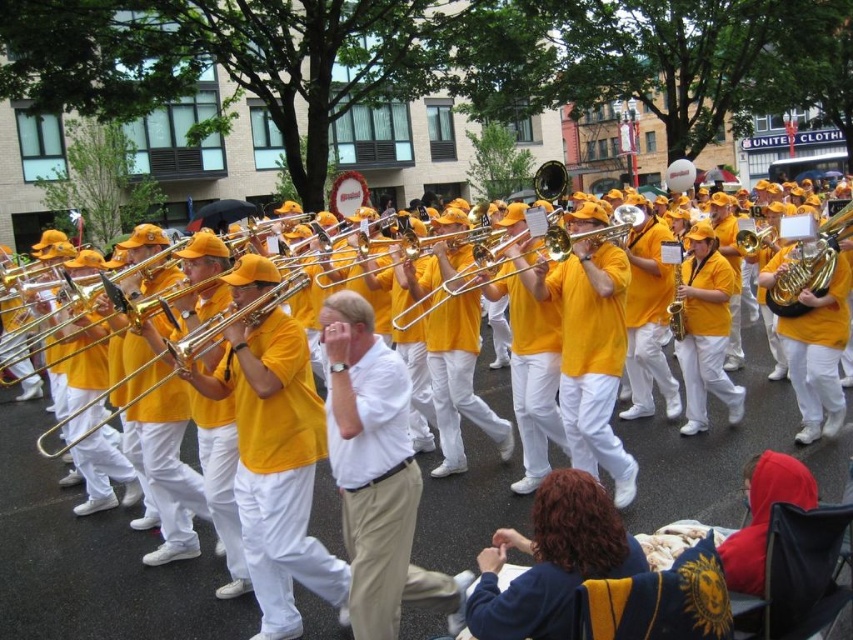
Is point (479, 500) more distant than point (762, 237)?

No.

Is matte yellow trombone at center taller than gold shiny trumpet at center?

Indeed, matte yellow trombone at center has a greater height compared to gold shiny trumpet at center.

You are a GUI agent. You are given a task and a screenshot of the screen. Output one action in this format:
    pyautogui.click(x=<x>, y=<y>)
    Task: Click on the matte yellow trombone at center
    This screenshot has width=853, height=640.
    Given the screenshot: What is the action you would take?
    pyautogui.click(x=91, y=561)

Is point (585, 481) farther from camera compared to point (772, 227)?

No, it is not.

Does dark blue fleece at lower center have a greater height compared to gold shiny trumpet at center?

Yes.

The height and width of the screenshot is (640, 853). I want to click on dark blue fleece at lower center, so click(x=550, y=561).

Does white cotton shirt at center appear on the left side of dark blue fleece at lower center?

Correct, you'll find white cotton shirt at center to the left of dark blue fleece at lower center.

Is point (387, 381) closer to viewer compared to point (492, 577)?

No.

Which is behind, point (404, 452) or point (561, 561)?

Positioned behind is point (404, 452).

This screenshot has width=853, height=640. I want to click on white cotton shirt at center, so click(x=376, y=474).